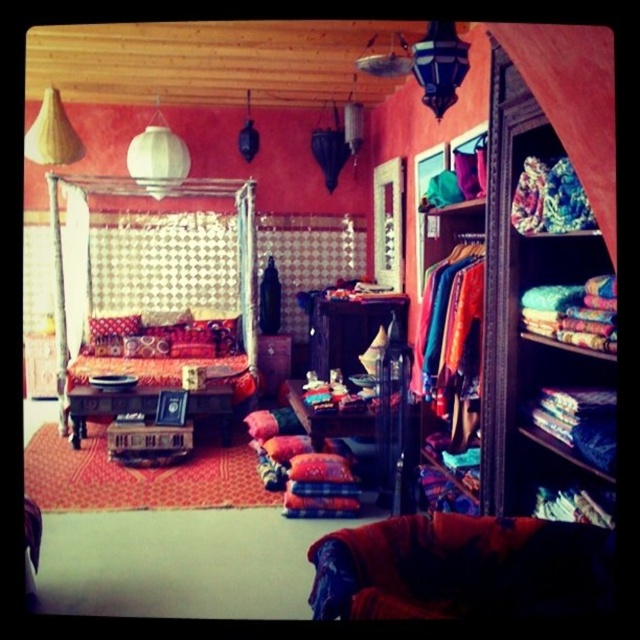
Which is in front, point (124, 186) or point (70, 317)?

Positioned in front is point (70, 317).

Measure the distance from textured fabric bed at center to white sheer curtain at left.

textured fabric bed at center is 24.42 inches from white sheer curtain at left.

Which is behind, point (84, 188) or point (65, 260)?

Positioned behind is point (84, 188).

Identify the location of textured fabric bed at center. The width and height of the screenshot is (640, 640). (141, 195).